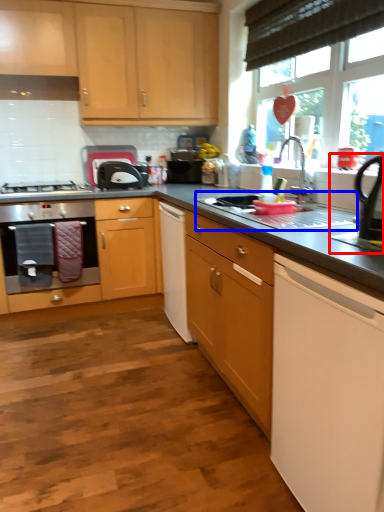
Question: Among these objects, which one is farthest to the camera, appliance (highlighted by a red box) or sink (highlighted by a blue box)?

Choices:
 (A) appliance
 (B) sink

Answer: (B)